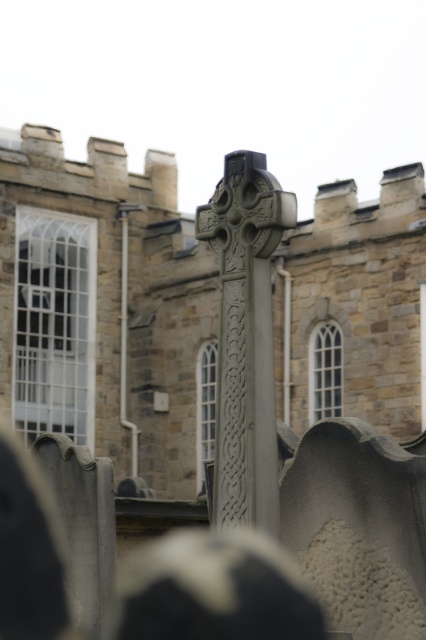
Question: Which of the following is the farthest from the observer?

Choices:
 (A) tap(227, 374)
 (B) tap(29, 132)

Answer: (B)

Question: Which point appears farthest from the camera in this image?

Choices:
 (A) (x=403, y=307)
 (B) (x=230, y=204)

Answer: (A)

Question: Can you confirm if gray stone church at center is positioned above gray stone cross at center?

Choices:
 (A) yes
 (B) no

Answer: (B)

Question: Is gray stone church at center to the right of gray stone cross at center from the viewer's perspective?

Choices:
 (A) no
 (B) yes

Answer: (A)

Question: Observing the image, what is the correct spatial positioning of gray stone church at center in reference to gray stone cross at center?

Choices:
 (A) above
 (B) below

Answer: (B)

Question: Which point appears farthest from the camera in this image?

Choices:
 (A) (252, 419)
 (B) (166, 353)

Answer: (B)